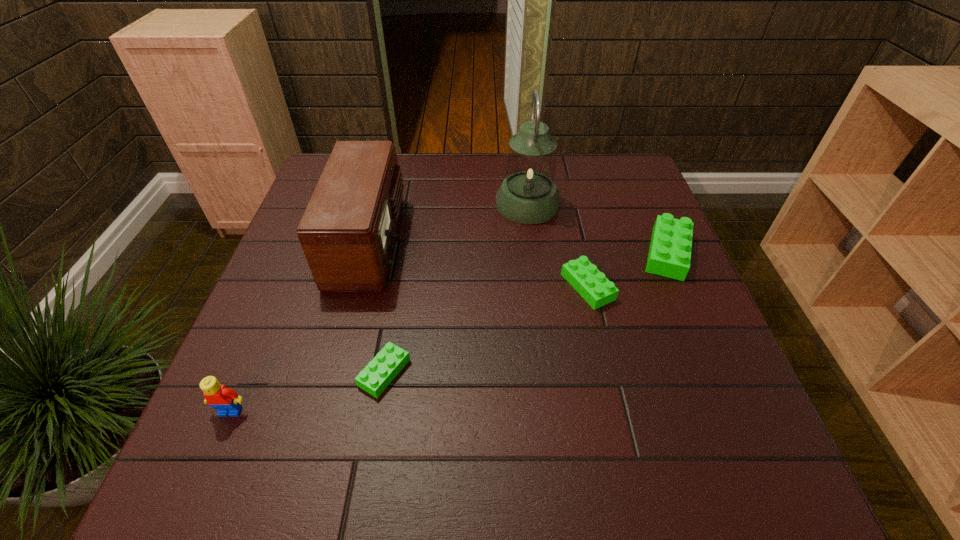
Where is `blank area located 0.180m on the back of the second Lego from left to right`? blank area located 0.180m on the back of the second Lego from left to right is located at coordinates (399, 284).

Where is `vacant area situated on the front of the third tallest Lego`? vacant area situated on the front of the third tallest Lego is located at coordinates (607, 369).

The height and width of the screenshot is (540, 960). I want to click on free space located 0.090m on the front of the rightmost object, so click(x=693, y=311).

Find the location of a particular element. free space located 0.250m on the left of the tallest object is located at coordinates (406, 205).

Locate an element on the screen. free spot located 0.370m on the front-facing side of the second tallest object is located at coordinates (546, 241).

Locate an element on the screen. The image size is (960, 540). object that is at the far edge is located at coordinates (528, 195).

Identify the location of radio receiver that is at the left edge. (347, 232).

You are a GUI agent. You are given a task and a screenshot of the screen. Output one action in this format:
    pyautogui.click(x=<x>, y=<y>)
    Task: Click on the Lego at the left edge
    
    Given the screenshot: What is the action you would take?
    pyautogui.click(x=227, y=402)

Identify the location of object situated at the right edge. This screenshot has height=540, width=960. (669, 255).

The image size is (960, 540). I want to click on object that is at the near left corner, so click(x=227, y=402).